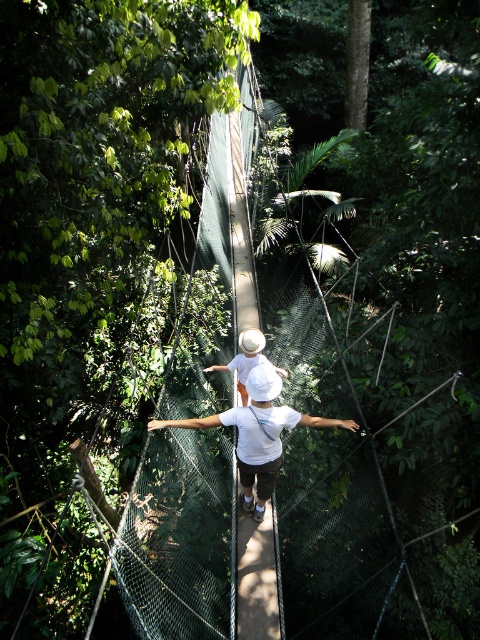
You are standing on the canopy walkway and notice two people at the center wearing white matte shirts and hats. Which clothing item is closer to you, the white matte shirt at center or the white matte hat at center?

The white matte shirt at center is closer to the viewer than the white matte hat at center.

You are a photographer trying to capture a clear photo of the white matte shirt at center and the white matte hat at center. Since both are white, you need to adjust your camera settings to ensure one doesn not overpower the other. Which object should you focus on to avoid overexposure, considering their sizes?

The white matte shirt at center is wider than the white matte hat at center, so focusing on the shirt would help avoid overexposure as it covers more area and might reflect more light.

You are a park ranger checking the safety of the canopy walkway. You notice two people wearing white matte shirts and hats at the center. According to safety regulations, the minimum distance between any two people on the walkway must be at least 36 inches to prevent collisions. Is the distance between the white matte shirt at center and the white matte hat at center compliant with this regulation?

The distance between the white matte shirt at center and the white matte hat at center is 30.93 inches, which is less than the required 36 inches. Therefore, it does not comply with the safety regulation.